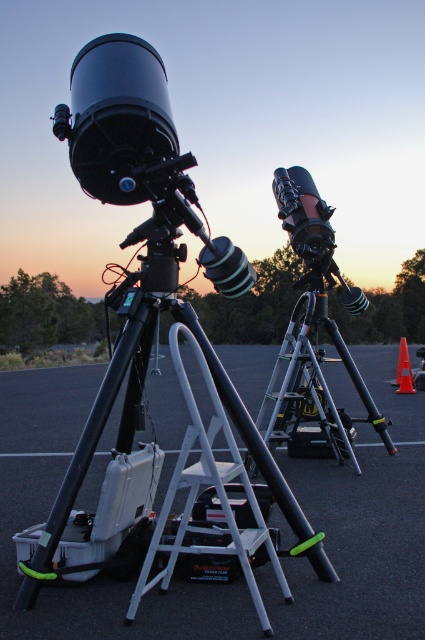
Question: Is white plastic ladder at center closer to the viewer compared to orange plastic traffic cone at right?

Choices:
 (A) yes
 (B) no

Answer: (A)

Question: Which point is closer to the camera?

Choices:
 (A) (271, 577)
 (B) (407, 368)

Answer: (A)

Question: Which object is positioned closest to the orange plastic traffic cone at right?

Choices:
 (A) white plastic ladder at center
 (B) orange plastic traffic cone at center right

Answer: (B)

Question: Considering the real-world distances, which object is closest to the orange plastic traffic cone at right?

Choices:
 (A) black plastic tripod at center
 (B) orange plastic traffic cone at center right
 (C) white plastic ladder at center
 (D) black matte tripod at center

Answer: (B)

Question: Does orange plastic traffic cone at right have a lesser width compared to orange plastic traffic cone at center right?

Choices:
 (A) no
 (B) yes

Answer: (A)

Question: Can you confirm if black plastic tripod at center is wider than orange plastic traffic cone at center right?

Choices:
 (A) yes
 (B) no

Answer: (A)